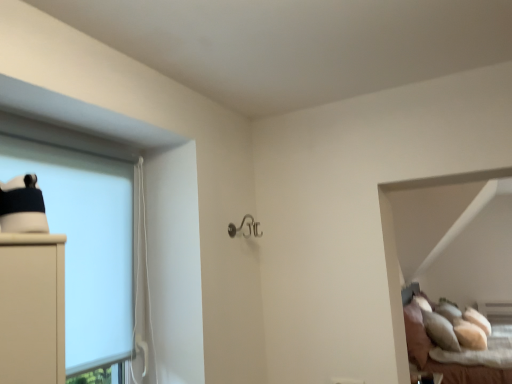
Where is `soft beige pillows at lower right`? soft beige pillows at lower right is located at coordinates (435, 345).

What do you see at coordinates (435, 345) in the screenshot?
I see `soft beige pillows at lower right` at bounding box center [435, 345].

Measure the distance between point (419, 340) and camera.

Point (419, 340) and camera are 13.29 feet apart.

This screenshot has height=384, width=512. What do you see at coordinates (86, 244) in the screenshot?
I see `white matte cabinet at left` at bounding box center [86, 244].

What is the approximate width of white matte cabinet at left?

2.45 inches.

Find the location of `white matte cabinet at left`. white matte cabinet at left is located at coordinates (86, 244).

The height and width of the screenshot is (384, 512). I want to click on soft beige pillows at lower right, so click(435, 345).

Between white matte cabinet at left and soft beige pillows at lower right, which one appears on the right side from the viewer's perspective?

soft beige pillows at lower right.

Does white matte cabinet at left come behind soft beige pillows at lower right?

That is False.

Is point (123, 190) more distant than point (490, 369)?

No.

From the image's perspective, would you say white matte cabinet at left is positioned over soft beige pillows at lower right?

Yes, from the image's perspective, white matte cabinet at left is over soft beige pillows at lower right.

From a real-world perspective, is white matte cabinet at left positioned above or below soft beige pillows at lower right?

In terms of real-world spatial position, white matte cabinet at left is above soft beige pillows at lower right.

Which object is thinner, white matte cabinet at left or soft beige pillows at lower right?

With smaller width is white matte cabinet at left.

Is white matte cabinet at left taller or shorter than soft beige pillows at lower right?

Clearly, white matte cabinet at left is shorter compared to soft beige pillows at lower right.

Who is bigger, white matte cabinet at left or soft beige pillows at lower right?

Bigger between the two is soft beige pillows at lower right.

Is white matte cabinet at left outside of soft beige pillows at lower right?

Yes, white matte cabinet at left is outside of soft beige pillows at lower right.

Is white matte cabinet at left next to soft beige pillows at lower right?

No, white matte cabinet at left is not beside soft beige pillows at lower right.

Is white matte cabinet at left facing towards soft beige pillows at lower right?

No.

Measure the distance from white matte cabinet at left to soft beige pillows at lower right.

white matte cabinet at left is 3.14 meters away from soft beige pillows at lower right.

The width and height of the screenshot is (512, 384). I want to click on bed located underneath the white matte cabinet at left (from a real-world perspective), so click(435, 345).

Between soft beige pillows at lower right and white matte cabinet at left, which one appears on the left side from the viewer's perspective?

white matte cabinet at left is more to the left.

Between soft beige pillows at lower right and white matte cabinet at left, which one is positioned behind?

soft beige pillows at lower right is further from the camera.

Is point (416, 293) closer to viewer compared to point (87, 288)?

No, it is behind (87, 288).

From the image's perspective, is soft beige pillows at lower right located above or below white matte cabinet at left?

Based on their image positions, soft beige pillows at lower right is located beneath white matte cabinet at left.

From a real-world perspective, which is physically above, soft beige pillows at lower right or white matte cabinet at left?

In real-world perspective, white matte cabinet at left is above.

Based on the photo, in terms of width, does soft beige pillows at lower right look wider or thinner when compared to white matte cabinet at left?

In the image, soft beige pillows at lower right appears to be wider than white matte cabinet at left.

From their relative heights in the image, would you say soft beige pillows at lower right is taller or shorter than white matte cabinet at left?

Considering their sizes, soft beige pillows at lower right has more height than white matte cabinet at left.

Who is smaller, soft beige pillows at lower right or white matte cabinet at left?

With smaller size is white matte cabinet at left.

Can we say soft beige pillows at lower right lies outside white matte cabinet at left?

soft beige pillows at lower right lies outside white matte cabinet at left's area.

Is there a large distance between soft beige pillows at lower right and white matte cabinet at left?

soft beige pillows at lower right is positioned a significant distance from white matte cabinet at left.

Based on the photo, is soft beige pillows at lower right oriented towards white matte cabinet at left?

No, soft beige pillows at lower right is not aimed at white matte cabinet at left.

How different are the orientations of soft beige pillows at lower right and white matte cabinet at left in degrees?

0.592 degrees.

How much distance is there between soft beige pillows at lower right and white matte cabinet at left?

3.14 meters.

What are the coordinates of `bed on the right of white matte cabinet at left` in the screenshot? It's located at (435, 345).

Locate an element on the screen. bed below the white matte cabinet at left (from the image's perspective) is located at coordinates (435, 345).

Find the location of a particular element. Image resolution: width=512 pixels, height=384 pixels. bed that is under the white matte cabinet at left (from a real-world perspective) is located at coordinates (435, 345).